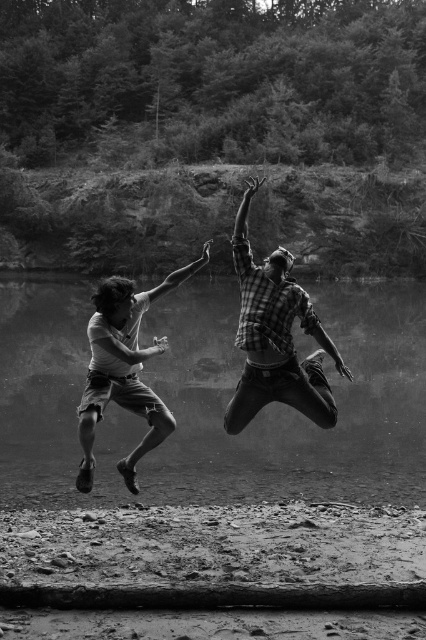
Between point (86, 419) and point (313, 403), which one is positioned behind?

The point (313, 403) is more distant.

Is plaid shirt at center closer to the viewer compared to checkered fabric man at center?

No, plaid shirt at center is behind checkered fabric man at center.

Does point (239, 420) lie in front of point (253, 288)?

No, (239, 420) is behind (253, 288).

You are a GUI agent. You are given a task and a screenshot of the screen. Output one action in this format:
    pyautogui.click(x=<x>, y=<y>)
    Task: Click on the plaid shirt at center
    This screenshot has width=426, height=640.
    Given the screenshot: What is the action you would take?
    pyautogui.click(x=275, y=336)

Is point (256, 186) farther from camera compared to point (316, 600)?

Yes, point (256, 186) is farther from viewer.

Where is `checkered fabric man at center`? This screenshot has width=426, height=640. checkered fabric man at center is located at coordinates [273, 336].

Does point (305, 401) come closer to viewer compared to point (135, 605)?

No, (305, 401) is behind (135, 605).

Is plaid shirt at center to the right of rough textured log at lower center from the viewer's perspective?

Incorrect, plaid shirt at center is not on the right side of rough textured log at lower center.

Who is more forward, (207, 248) or (149, 584)?

Point (149, 584) is in front.

Identify the location of plaid shirt at center. (275, 336).